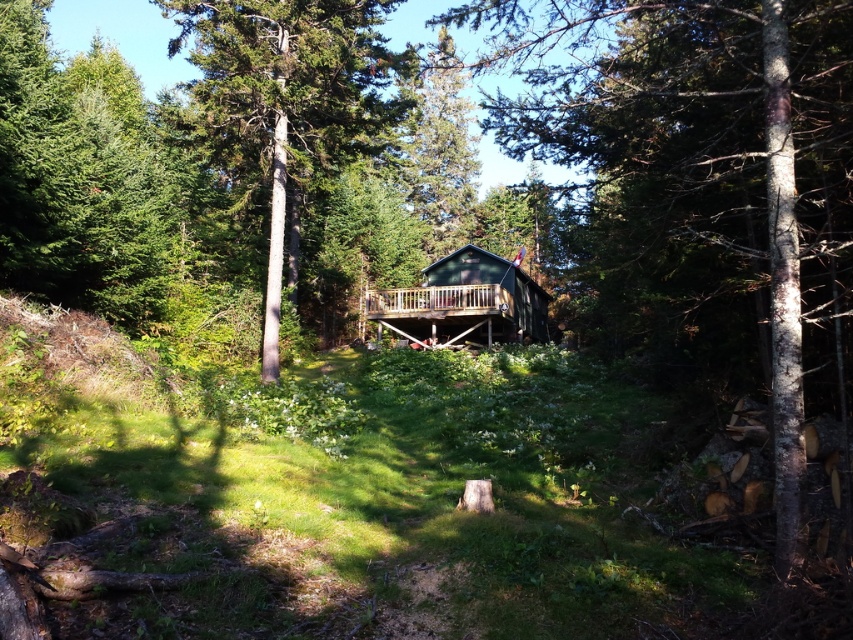
Question: Can you confirm if green wood cabin at center is positioned to the right of green matte cabin at center?

Choices:
 (A) no
 (B) yes

Answer: (B)

Question: Is smooth gray tree trunk at center in front of green matte cabin at center?

Choices:
 (A) no
 (B) yes

Answer: (B)

Question: Estimate the real-world distances between objects in this image. Which object is closer to the green wood cabin at center?

Choices:
 (A) smooth gray tree trunk at center
 (B) green matte cabin at center

Answer: (B)

Question: Which object is positioned closest to the smooth gray tree trunk at center?

Choices:
 (A) green matte cabin at center
 (B) green wood cabin at center

Answer: (A)

Question: Which of the following is the farthest from the observer?

Choices:
 (A) (229, 8)
 (B) (408, 296)
 (C) (590, 109)

Answer: (B)

Question: Does green wood cabin at center appear on the left side of smooth gray tree trunk at center?

Choices:
 (A) yes
 (B) no

Answer: (B)